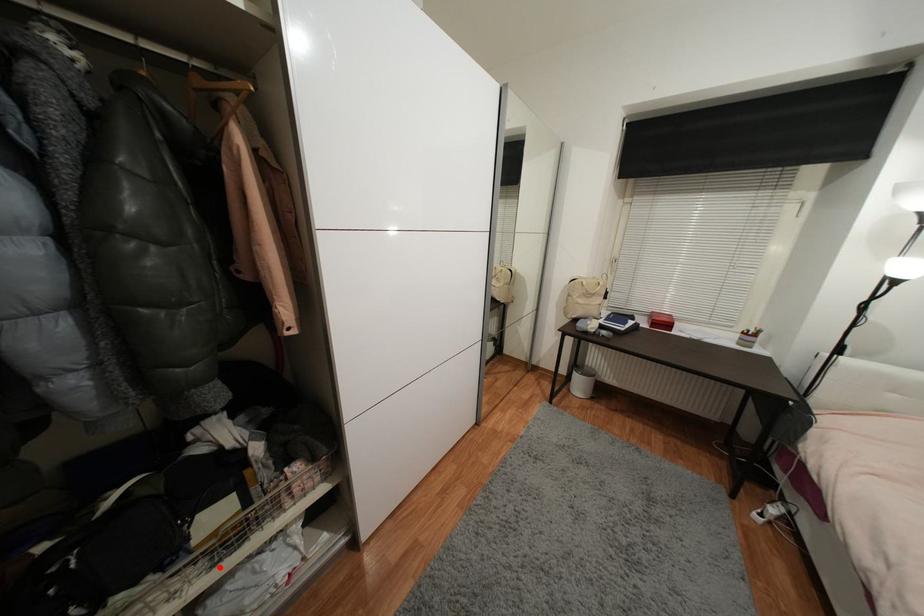
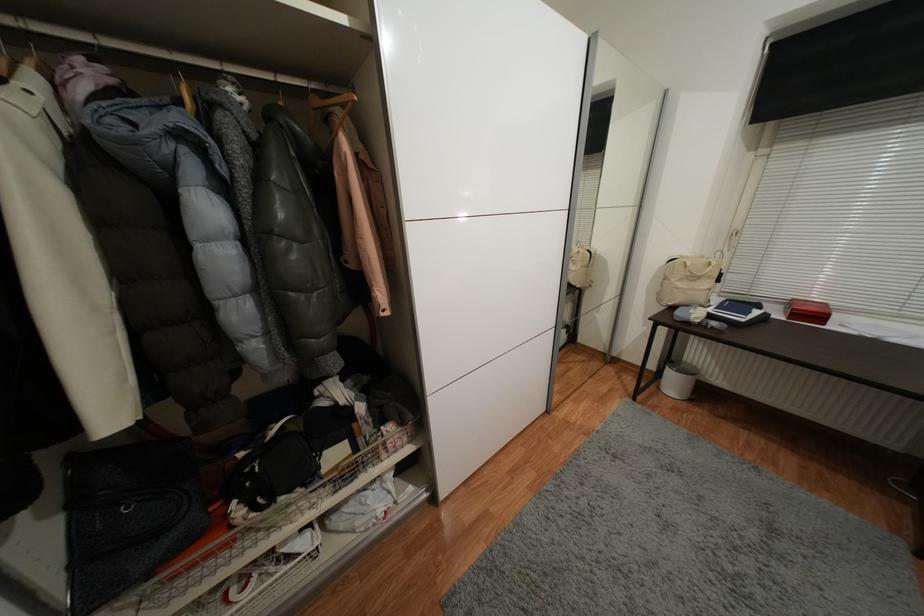
Question: I am providing you with two images of the same scene from different viewpoints. A red point is shown in image1. For the corresponding object point in image2, is it positioned nearer or farther from the camera?

Choices:
 (A) Nearer
 (B) Farther

Answer: (B)